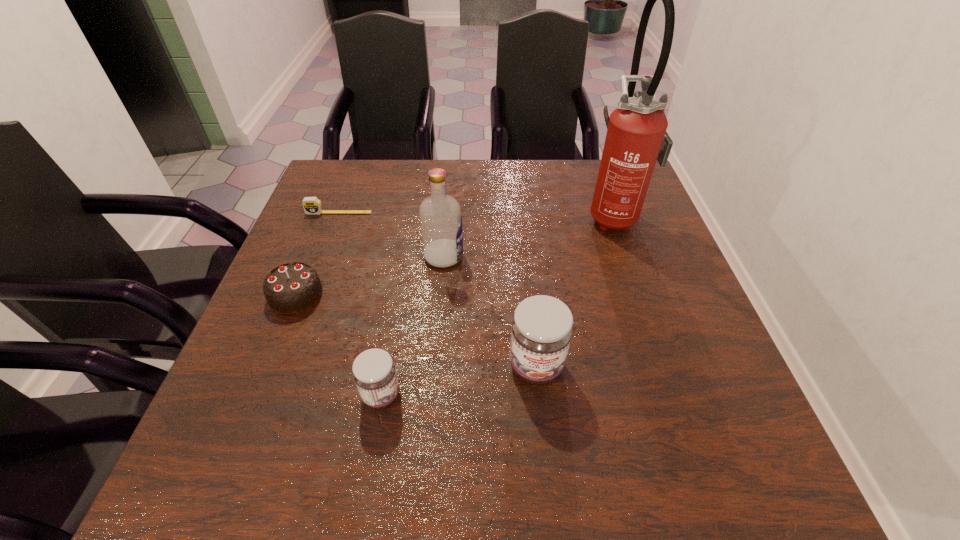
Locate an element on the screen. This screenshot has width=960, height=540. vacant area that lies between the third object from left to right and the vodka is located at coordinates pos(413,326).

I want to click on free area in between the shortest object and the fifth shortest object, so click(392, 235).

The image size is (960, 540). Identify the location of free space between the tape measure and the right jam. tap(438, 289).

Identify the location of vacant area that lies between the fourth object from left to right and the taller jam. Image resolution: width=960 pixels, height=540 pixels. (490, 312).

You are a GUI agent. You are given a task and a screenshot of the screen. Output one action in this format:
    pyautogui.click(x=<x>, y=<y>)
    Task: Click on the vacant space in between the shortest object and the fourth object from right to left
    This screenshot has height=540, width=960.
    Given the screenshot: What is the action you would take?
    pyautogui.click(x=360, y=304)

At what (x,y) coordinates should I click in order to perform the action: click on free spot between the fifth tallest object and the vodka. Please return your answer as a coordinate pair (x, y). Looking at the image, I should click on (370, 276).

Identify the location of unoccupied area between the right jam and the shorter jam. This screenshot has width=960, height=540. (459, 381).

Find the location of a particular element. Image resolution: width=960 pixels, height=540 pixels. free spot between the fire extinguisher and the shortest object is located at coordinates (476, 214).

Find the location of `free point between the fourth nearest object and the fire extinguisher`. free point between the fourth nearest object and the fire extinguisher is located at coordinates (529, 236).

Locate which object is the fifth closest to the fourth farthest object. Please provide its 2D coordinates. Your answer should be formatted as a tuple, i.e. [(x, y)], where the tuple contains the x and y coordinates of a point satisfying the conditions above.

[(636, 138)]